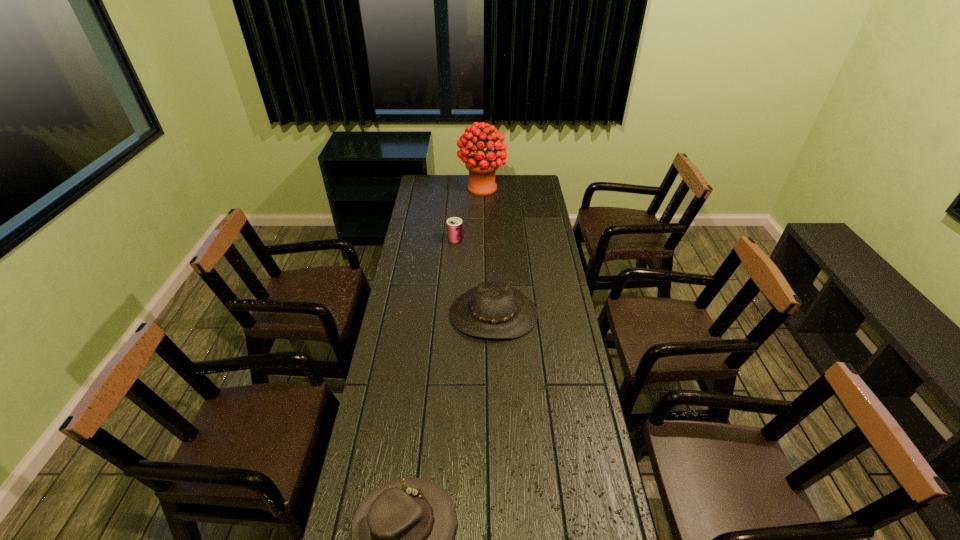
Where is `free spot at the far edge of the desktop`? This screenshot has width=960, height=540. free spot at the far edge of the desktop is located at coordinates (462, 183).

Find the location of `vacant region at the left edge of the desktop`. vacant region at the left edge of the desktop is located at coordinates (438, 232).

In the image, there is a desktop. At what (x,y) coordinates should I click in order to perform the action: click on vacant space at the right edge. Please return your answer as a coordinate pair (x, y). Looking at the image, I should click on [x=565, y=484].

In the image, there is a desktop. What are the coordinates of `vacant space at the far left corner` in the screenshot? It's located at (441, 188).

Find the location of a particular element. The width and height of the screenshot is (960, 540). free space at the far right corner of the desktop is located at coordinates coord(534,182).

This screenshot has width=960, height=540. In order to click on vacant area that lies between the can and the farther hat in this screenshot , I will do `click(474, 277)`.

The height and width of the screenshot is (540, 960). Identify the location of free space between the bouquet and the third nearest object. (468, 214).

Find the location of a particular element. free space between the second farthest object and the tallest object is located at coordinates (468, 214).

Locate an element on the screen. vacant area that lies between the third nearest object and the bouquet is located at coordinates (468, 214).

This screenshot has width=960, height=540. Find the location of `vacant region between the farthest object and the can`. vacant region between the farthest object and the can is located at coordinates (468, 214).